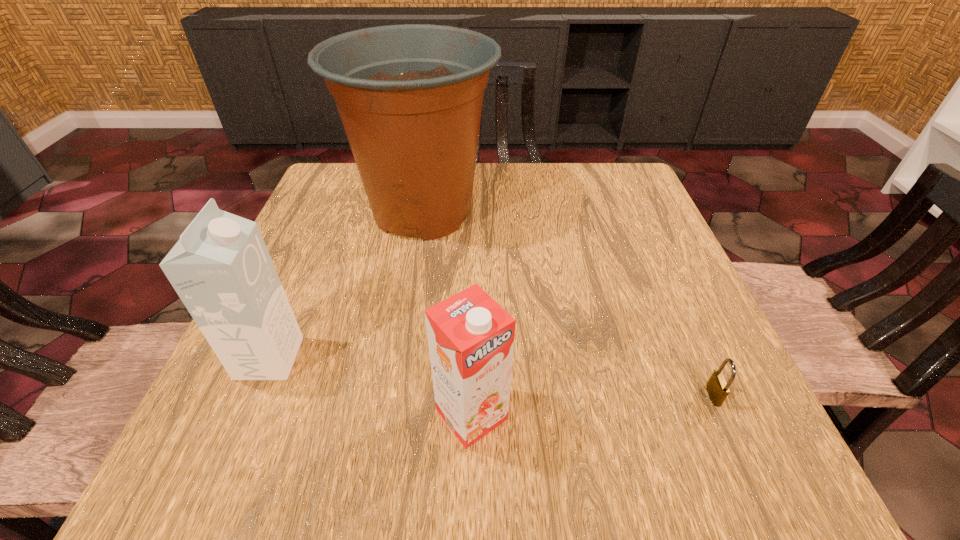
At what (x,y) coordinates should I click in order to perform the action: click on flowerpot. Please return your answer as a coordinate pair (x, y). The image size is (960, 540). Looking at the image, I should click on (410, 96).

Where is `the farthest object`? the farthest object is located at coordinates (410, 96).

Identify the location of the taller carton. The image size is (960, 540). (221, 269).

Locate an element on the screen. Image resolution: width=960 pixels, height=540 pixels. the second farthest object is located at coordinates (221, 269).

Where is `the shorter carton`? the shorter carton is located at coordinates (470, 336).

Locate an element on the screen. the second shortest object is located at coordinates click(x=470, y=336).

Locate an element on the screen. the rightmost object is located at coordinates (717, 386).

Locate an element on the screen. the shortest object is located at coordinates (717, 386).

Where is `free space located on the front of the tallest object`? This screenshot has height=540, width=960. free space located on the front of the tallest object is located at coordinates (398, 358).

In order to click on blank area located on the front label of the farther carton in this screenshot , I will do `click(345, 358)`.